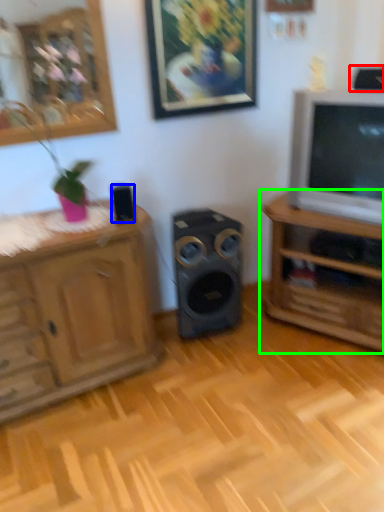
Question: Which object is the farthest from speaker (highlighted by a red box)? Choose among these: speaker (highlighted by a blue box) or shelf (highlighted by a green box).

Choices:
 (A) speaker
 (B) shelf

Answer: (A)